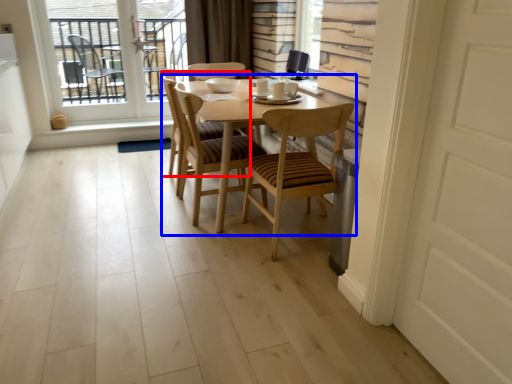
Question: Which object appears farthest to the camera in this image, chair (highlighted by a red box) or kitchen & dining room table (highlighted by a blue box)?

Choices:
 (A) chair
 (B) kitchen & dining room table

Answer: (A)